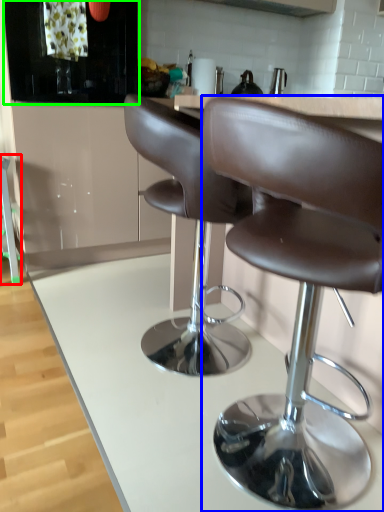
Question: Which object is positioned farthest from bar stool (highlighted by a red box)? Select from chair (highlighted by a blue box) and cabinetry (highlighted by a green box).

Choices:
 (A) chair
 (B) cabinetry

Answer: (A)